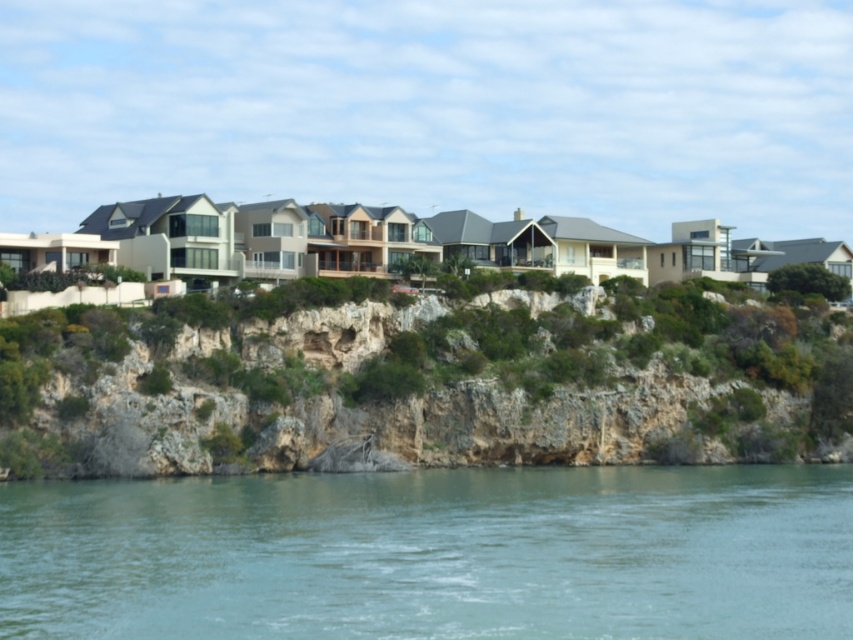
You are standing at the cliff edge and want to jump into the clear water at lower center. The safety rule states that you must be at least 50 meters away from the water to jump safely. Is this location safe for jumping?

The clear water at lower center is 47.99 meters away from the viewer. Since the required safe distance is 50 meters, this location is not safe for jumping as it is 2.01 meters too close.

You are a photographer planning to capture a wide shot of the coastal scene. You want to ensure that both the clear water at lower center and the green rocky cliff at center are visible in your frame. Based on their positions, which object should you position closer to the left side of your camera viewfinder?

→ The clear water at lower center should be positioned closer to the left side of your camera viewfinder since it is located on the left side of the green rocky cliff at center.